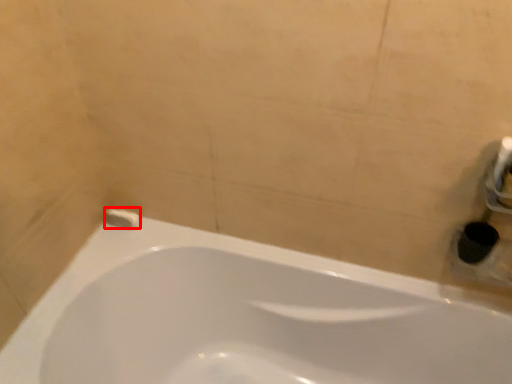
Question: From the image's perspective, where is toilet paper (annotated by the red box) located in relation to bathtub in the image?

Choices:
 (A) below
 (B) above

Answer: (B)